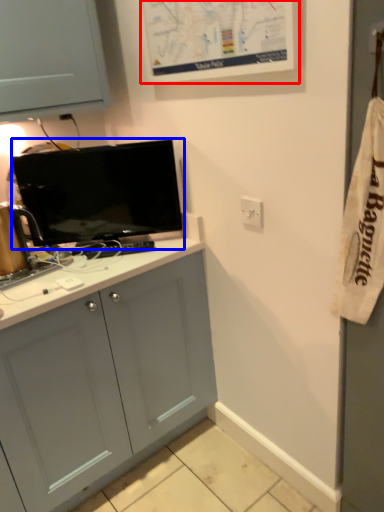
Question: Which point is further to the camera, bulletin board (highlighted by a red box) or television (highlighted by a blue box)?

Choices:
 (A) bulletin board
 (B) television

Answer: (B)